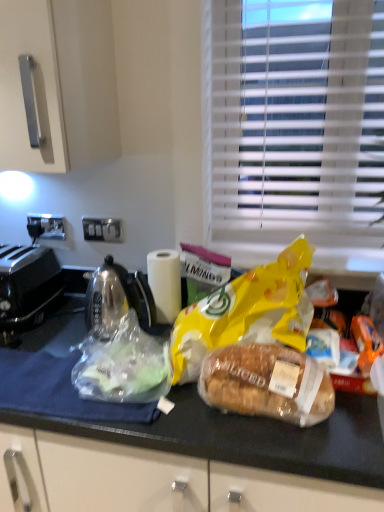
Question: Is white matte paper towel at center bigger or smaller than translucent plastic bag at center, positioned as the second plastic bag in right-to-left order?

Choices:
 (A) small
 (B) big

Answer: (A)

Question: Would you say white matte paper towel at center is inside or outside translucent plastic bag at center, positioned as the second plastic bag in right-to-left order?

Choices:
 (A) inside
 (B) outside

Answer: (B)

Question: Which object is the closest to the translucent plastic bag at center, positioned as the second plastic bag in right-to-left order?

Choices:
 (A) white plastic blinds at upper right
 (B) translucent plastic bread at center
 (C) translucent plastic bag at center
 (D) white matte paper towel at center
 (E) yellow plastic bag at upper center

Answer: (C)

Question: Estimate the real-world distances between objects in this image. Which object is farther from the black plastic toaster at left?

Choices:
 (A) translucent plastic bread at center
 (B) yellow matte plastic bag at center, the first plastic bag viewed from the right
 (C) white plastic blinds at upper right
 (D) yellow plastic bag at upper center
 (E) white matte paper towel at center

Answer: (C)